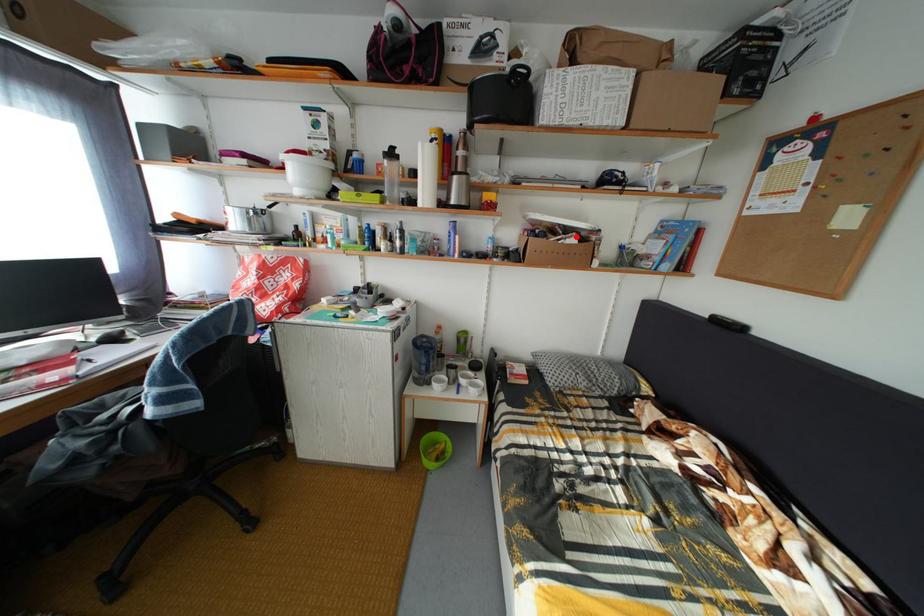
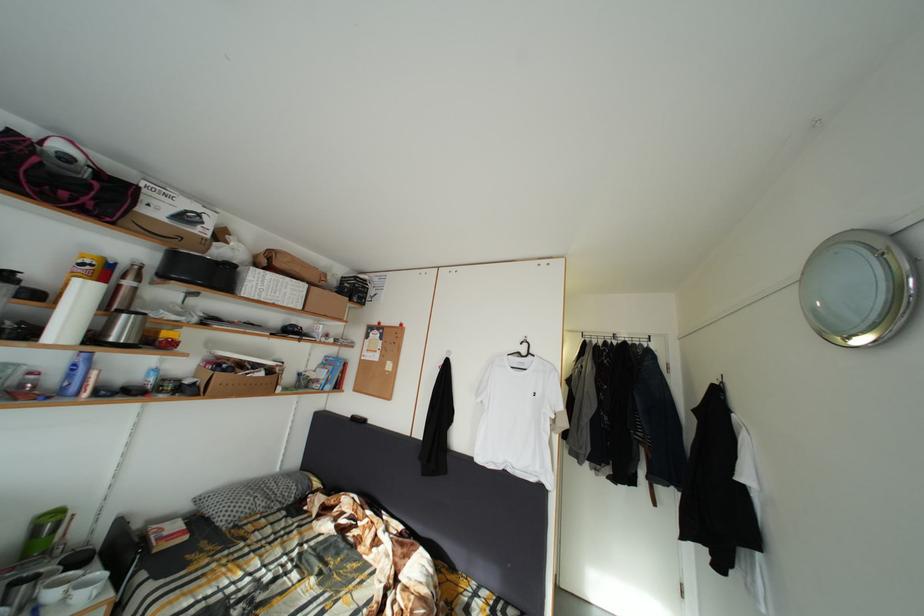
Find the pixel in the second image that matches the highlighted location in the first image.

(264, 373)